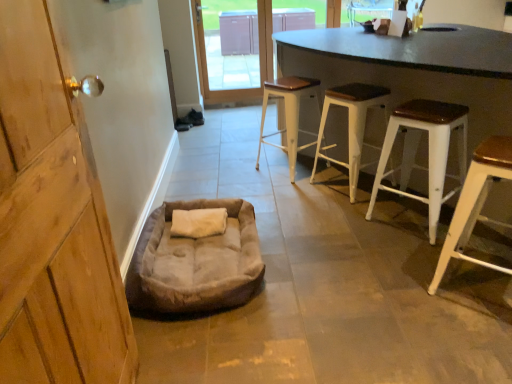
The width and height of the screenshot is (512, 384). What do you see at coordinates (413, 68) in the screenshot?
I see `black matte table at center` at bounding box center [413, 68].

I want to click on white metal stool at right, which is the 3th stool from back to front, so click(428, 152).

This screenshot has height=384, width=512. What do you see at coordinates (475, 203) in the screenshot?
I see `white wood stool at right, which is counted as the fourth stool, starting from the back` at bounding box center [475, 203].

Locate an element on the screen. The width and height of the screenshot is (512, 384). black matte table at center is located at coordinates (413, 68).

From the image's perspective, would you say wooden door handle at left is shown under transparent glass door at upper center?

Indeed, from the image's perspective, wooden door handle at left is shown beneath transparent glass door at upper center.

From a real-world perspective, is wooden door handle at left above or below transparent glass door at upper center?

Clearly, from a real-world perspective, wooden door handle at left is above transparent glass door at upper center.

Does wooden door handle at left appear on the right side of transparent glass door at upper center?

No.

Identify the location of cabinetry that is on the left side of transparent glass door at upper center. click(53, 223).

Would you consider suede-like beige dog bed at lower left to be distant from transparent glass door at upper center?

suede-like beige dog bed at lower left is far away from transparent glass door at upper center.

Considering the positions of objects suede-like beige dog bed at lower left and transparent glass door at upper center in the image provided, who is more to the right, suede-like beige dog bed at lower left or transparent glass door at upper center?

transparent glass door at upper center is more to the right.

Which is nearer, (x=340, y=87) or (x=230, y=237)?

The point (x=230, y=237) is closer to the camera.

Between white wood stool at center, which appears as the 2th stool when viewed from the back, and suede-like beige dog bed at lower left, which one has larger size?

With larger size is white wood stool at center, which appears as the 2th stool when viewed from the back.

Is suede-like beige dog bed at lower left at the back of white wood stool at center, which appears as the 2th stool when viewed from the back?

Yes, suede-like beige dog bed at lower left is at the back of white wood stool at center, which appears as the 2th stool when viewed from the back.

Can you tell me how much white wood stool at center, which is counted as the third stool, starting from the front, and suede-like beige dog bed at lower left differ in facing direction?

The angle between the facing direction of white wood stool at center, which is counted as the third stool, starting from the front, and the facing direction of suede-like beige dog bed at lower left is 32.2 degrees.

From the image's perspective, which object appears higher, suede-like beige dog bed at lower left or wooden door handle at left?

wooden door handle at left.

From a real-world perspective, is suede-like beige dog bed at lower left over wooden door handle at left?

No, from a real-world perspective, suede-like beige dog bed at lower left is not above wooden door handle at left.

Considering the sizes of suede-like beige dog bed at lower left and wooden door handle at left in the image, is suede-like beige dog bed at lower left taller or shorter than wooden door handle at left?

Clearly, suede-like beige dog bed at lower left is shorter compared to wooden door handle at left.

Would you consider suede-like beige dog bed at lower left to be distant from wooden door handle at left?

No, suede-like beige dog bed at lower left is not far away from wooden door handle at left.

Could you tell me if white metal stool at right, the 2th stool positioned from the front, is facing wooden door handle at left?

No, white metal stool at right, the 2th stool positioned from the front, is not facing towards wooden door handle at left.

Is white metal stool at right, the 2th stool positioned from the front, completely or partially outside of wooden door handle at left?

Yes, white metal stool at right, the 2th stool positioned from the front, is located beyond the bounds of wooden door handle at left.

Is the position of white metal stool at right, which is the 3th stool from back to front, less distant than that of wooden door handle at left?

No, the depth of white metal stool at right, which is the 3th stool from back to front, is greater than that of wooden door handle at left.

Who is bigger, white metal stool at right, which is the 3th stool from back to front, or wooden door handle at left?

Bigger between the two is white metal stool at right, which is the 3th stool from back to front.

From the picture: Which is correct: white metal stool at center, the 1th stool viewed from the back, is inside white wood stool at center, which is counted as the third stool, starting from the front, or outside of it?

white metal stool at center, the 1th stool viewed from the back, is not enclosed by white wood stool at center, which is counted as the third stool, starting from the front.

Which object is positioned more to the right, white metal stool at center, the 1th stool viewed from the back, or white wood stool at center, which appears as the 2th stool when viewed from the back?

white wood stool at center, which appears as the 2th stool when viewed from the back, is more to the right.

Is white metal stool at center, the 1th stool viewed from the back, taller than white wood stool at center, which is counted as the third stool, starting from the front?

In fact, white metal stool at center, the 1th stool viewed from the back, may be shorter than white wood stool at center, which is counted as the third stool, starting from the front.

Is white metal stool at center, the 1th stool viewed from the back, closer to camera compared to white wood stool at center, which appears as the 2th stool when viewed from the back?

No, it is not.

Is suede-like beige dog bed at lower left far away from white metal stool at center, placed as the 4th stool when sorted from front to back?

Absolutely, suede-like beige dog bed at lower left is distant from white metal stool at center, placed as the 4th stool when sorted from front to back.

From the image's perspective, does suede-like beige dog bed at lower left appear higher than white metal stool at center, the 1th stool viewed from the back?

Incorrect, from the image's perspective, suede-like beige dog bed at lower left is lower than white metal stool at center, the 1th stool viewed from the back.

Between suede-like beige dog bed at lower left and white metal stool at center, placed as the 4th stool when sorted from front to back, which one appears on the right side from the viewer's perspective?

From the viewer's perspective, white metal stool at center, placed as the 4th stool when sorted from front to back, appears more on the right side.

Consider the image. Can we say suede-like beige dog bed at lower left lies outside white metal stool at center, the 1th stool viewed from the back?

suede-like beige dog bed at lower left is positioned outside white metal stool at center, the 1th stool viewed from the back.

The image size is (512, 384). Identify the location of glass door above the wooden door handle at left (from the image's perspective). (256, 50).

Locate an element on the screen. Image resolution: width=512 pixels, height=384 pixels. dog bed located underneath the transparent glass door at upper center (from a real-world perspective) is located at coordinates (195, 262).

Estimate the real-world distances between objects in this image. Which object is further from transparent glass door at upper center, black matte table at center or suede-like beige dog bed at lower left?

Among the two, suede-like beige dog bed at lower left is located further to transparent glass door at upper center.

From the picture: Based on their spatial positions, is suede-like beige dog bed at lower left or white metal stool at right, which is the 3th stool from back to front, closer to white wood stool at right, placed as the 1th stool when sorted from front to back?

white metal stool at right, which is the 3th stool from back to front, lies closer to white wood stool at right, placed as the 1th stool when sorted from front to back, than the other object.

Estimate the real-world distances between objects in this image. Which object is further from black matte table at center, suede-like beige dog bed at lower left or white metal stool at right, which is the 3th stool from back to front?

suede-like beige dog bed at lower left lies further to black matte table at center than the other object.

Estimate the real-world distances between objects in this image. Which object is further from white metal stool at center, the 1th stool viewed from the back, white wood stool at center, which is counted as the third stool, starting from the front, or white wood stool at right, placed as the 1th stool when sorted from front to back?

The object further to white metal stool at center, the 1th stool viewed from the back, is white wood stool at right, placed as the 1th stool when sorted from front to back.

Considering their positions, is white wood stool at center, which is counted as the third stool, starting from the front, positioned further to white wood stool at right, placed as the 1th stool when sorted from front to back, than suede-like beige dog bed at lower left?

suede-like beige dog bed at lower left.

Based on their spatial positions, is white metal stool at center, placed as the 4th stool when sorted from front to back, or transparent glass door at upper center further from suede-like beige dog bed at lower left?

transparent glass door at upper center is further to suede-like beige dog bed at lower left.

Looking at this image, which object lies nearer to the anchor point white metal stool at center, the 1th stool viewed from the back, suede-like beige dog bed at lower left or white wood stool at center, which appears as the 2th stool when viewed from the back?

The object closer to white metal stool at center, the 1th stool viewed from the back, is white wood stool at center, which appears as the 2th stool when viewed from the back.

In the scene shown: Looking at the image, which one is located further to transparent glass door at upper center, white wood stool at center, which is counted as the third stool, starting from the front, or white metal stool at center, placed as the 4th stool when sorted from front to back?

The object further to transparent glass door at upper center is white wood stool at center, which is counted as the third stool, starting from the front.

Locate an element on the screen. This screenshot has height=384, width=512. table between suede-like beige dog bed at lower left and white wood stool at right, placed as the 1th stool when sorted from front to back, in the horizontal direction is located at coordinates (413, 68).

This screenshot has width=512, height=384. In order to click on dog bed between white wood stool at right, placed as the 1th stool when sorted from front to back, and transparent glass door at upper center from front to back in this screenshot , I will do `click(195, 262)`.

At what (x,y) coordinates should I click in order to perform the action: click on dog bed located between wooden door handle at left and transparent glass door at upper center in the depth direction. Please return your answer as a coordinate pair (x, y). Looking at the image, I should click on (195, 262).

The width and height of the screenshot is (512, 384). I want to click on dog bed between white wood stool at right, placed as the 1th stool when sorted from front to back, and white metal stool at center, placed as the 4th stool when sorted from front to back, from front to back, so click(x=195, y=262).